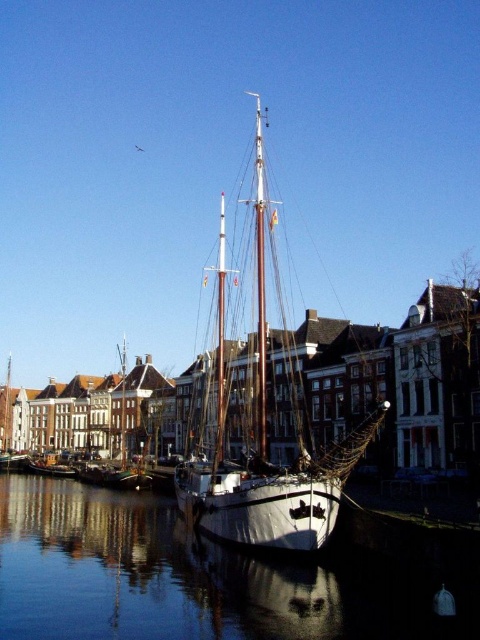
Who is taller, glossy water at center or white matte sailboat at center?

white matte sailboat at center is taller.

Does glossy water at center appear under white matte sailboat at center?

Yes, glossy water at center is below white matte sailboat at center.

Find the location of a particular element. The image size is (480, 640). glossy water at center is located at coordinates (171, 577).